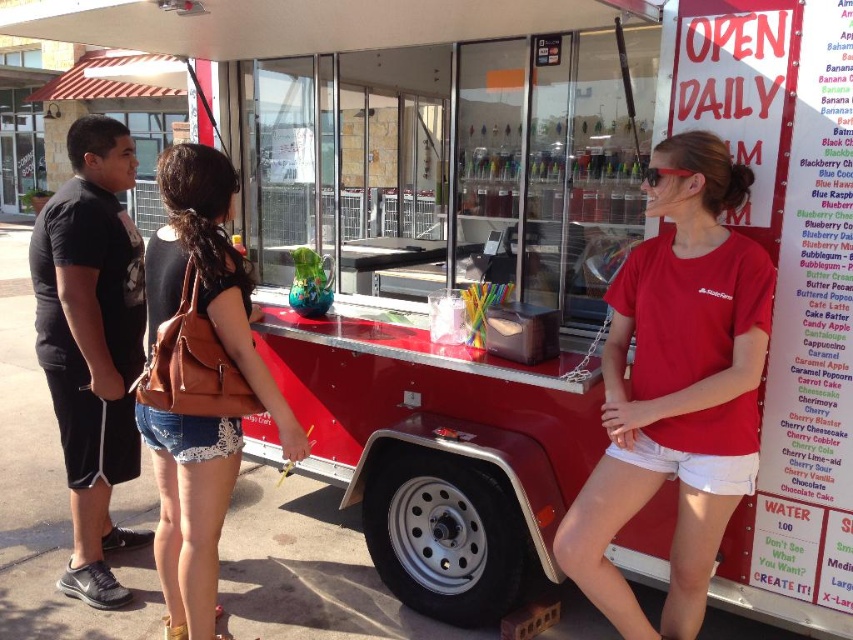
Can you confirm if red cotton t-shirt at center is taller than brown leather backpack at center?

Incorrect, red cotton t-shirt at center's height is not larger of brown leather backpack at center's.

Can you confirm if red cotton t-shirt at center is bigger than brown leather backpack at center?

No, red cotton t-shirt at center is not bigger than brown leather backpack at center.

This screenshot has width=853, height=640. Find the location of `red cotton t-shirt at center`. red cotton t-shirt at center is located at coordinates (676, 387).

Does brown leather backpack at center appear over black cotton t-shirt at left?

No, brown leather backpack at center is not above black cotton t-shirt at left.

Does brown leather backpack at center appear on the left side of black cotton t-shirt at left?

Incorrect, brown leather backpack at center is not on the left side of black cotton t-shirt at left.

Identify the location of brown leather backpack at center. (199, 380).

Identify the location of brown leather backpack at center. This screenshot has width=853, height=640. (199, 380).

Image resolution: width=853 pixels, height=640 pixels. What do you see at coordinates (676, 387) in the screenshot?
I see `red cotton t-shirt at center` at bounding box center [676, 387].

Looking at this image, which is below, red cotton t-shirt at center or black cotton t-shirt at left?

red cotton t-shirt at center is below.

Is point (744, 442) in front of point (71, 340)?

Yes, it is.

Where is `red cotton t-shirt at center`? red cotton t-shirt at center is located at coordinates click(x=676, y=387).